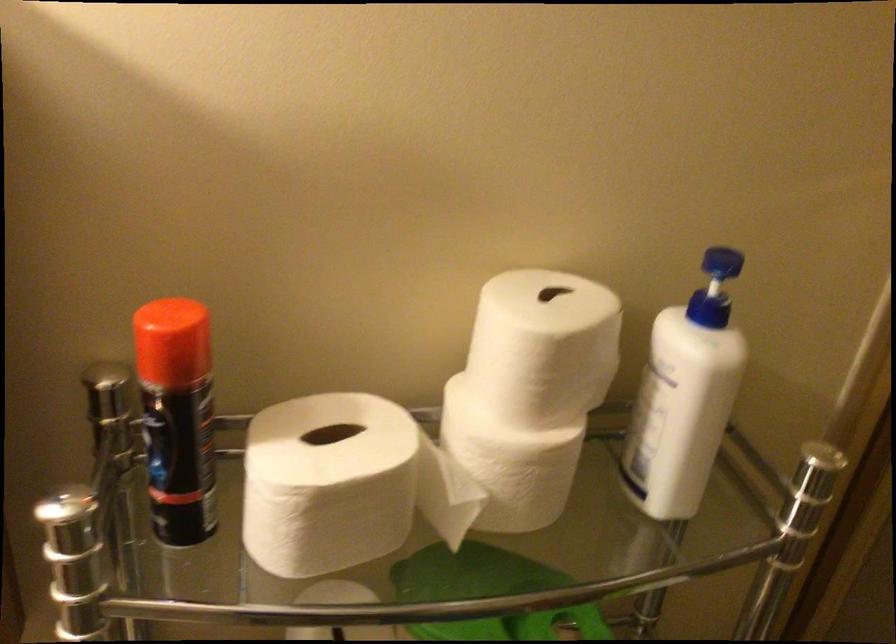
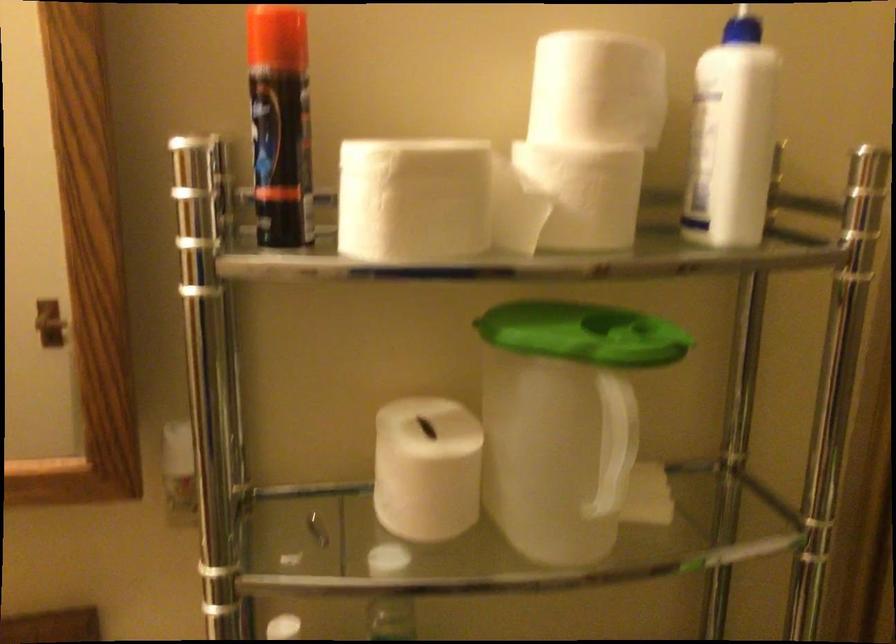
The point at [523,474] is marked in the first image. Where is the corresponding point in the second image?

(588, 194)